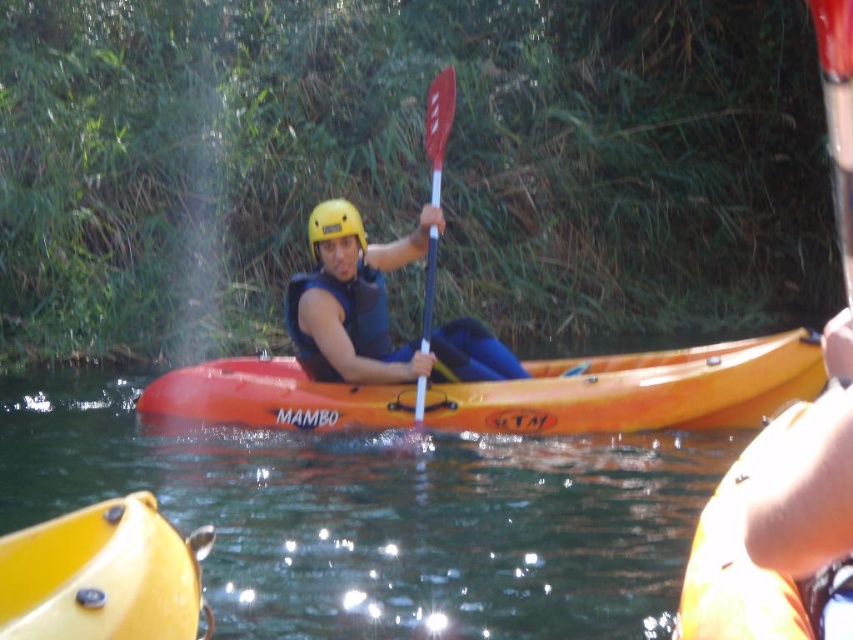
Question: Can you confirm if red plastic paddle at center is positioned above yellow matte helmet at center?

Choices:
 (A) yes
 (B) no

Answer: (A)

Question: Which of the following is the farthest from the observer?

Choices:
 (A) orange matte kayak at center
 (B) red plastic paddle at center
 (C) yellow plastic canoe at lower left
 (D) yellow matte helmet at center

Answer: (D)

Question: Can you confirm if matte blue life vest at center is positioned to the right of yellow matte helmet at center?

Choices:
 (A) yes
 (B) no

Answer: (A)

Question: From the image, what is the correct spatial relationship of orange matte kayak at center in relation to yellow plastic canoe at lower left?

Choices:
 (A) above
 (B) below

Answer: (A)

Question: Which point is farther to the camera?

Choices:
 (A) red plastic paddle at center
 (B) transparent orange kayak at center
 (C) yellow plastic canoe at lower left

Answer: (A)

Question: Which object appears farthest from the camera in this image?

Choices:
 (A) transparent orange kayak at center
 (B) orange matte kayak at center

Answer: (A)